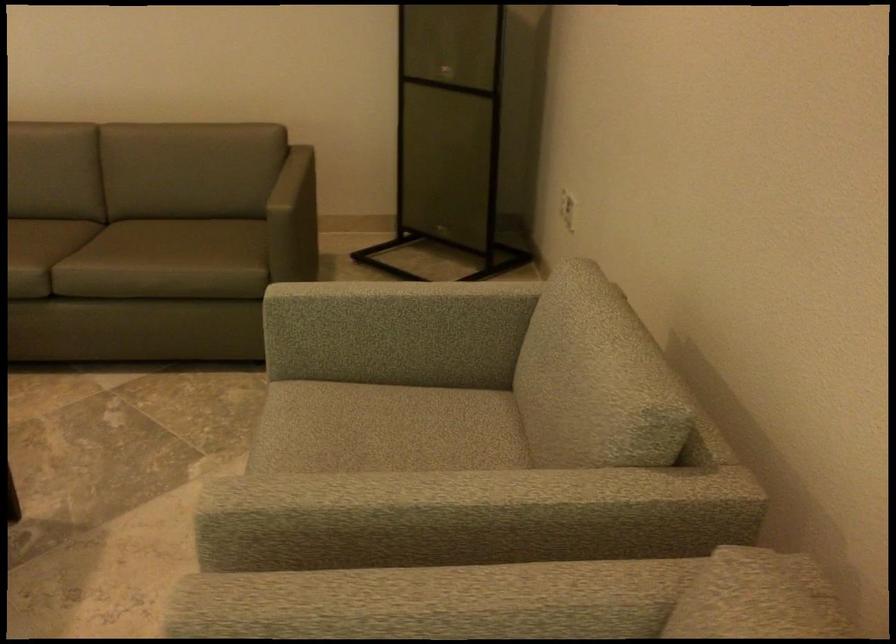
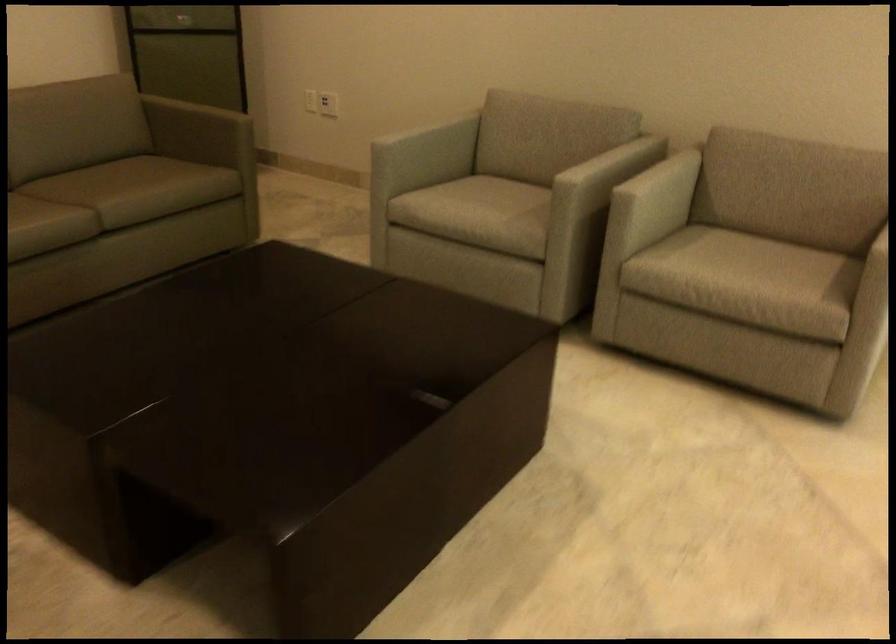
In the second image, find the point that corresponds to pixel 550 462 in the first image.

(588, 149)